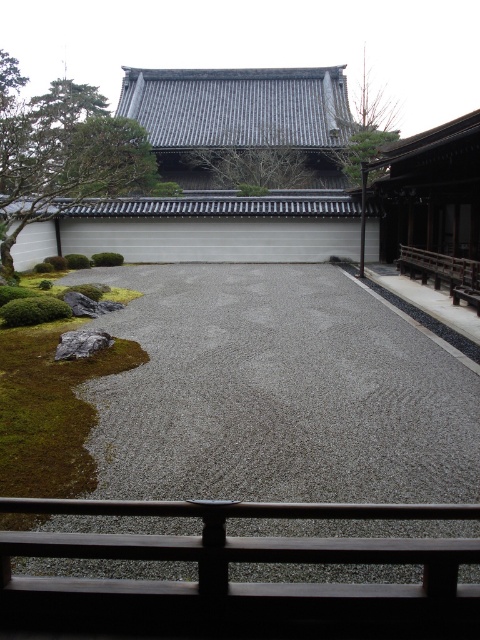
Is green leafy tree at upper center smaller than gray/smooth rock at lower left?

Incorrect, green leafy tree at upper center is not smaller in size than gray/smooth rock at lower left.

Does green leafy tree at upper center appear under gray/smooth rock at lower left?

Incorrect, green leafy tree at upper center is not positioned below gray/smooth rock at lower left.

This screenshot has height=640, width=480. Describe the element at coordinates (252, 166) in the screenshot. I see `green leafy tree at upper center` at that location.

Locate an element on the screen. green leafy tree at upper center is located at coordinates (252, 166).

Between gray gravel at center and green leafy tree at upper left, which one has less height?

gray gravel at center is shorter.

Does gray gravel at center have a larger size compared to green leafy tree at upper left?

Incorrect, gray gravel at center is not larger than green leafy tree at upper left.

Where is `gray gravel at center`? The image size is (480, 640). gray gravel at center is located at coordinates (278, 394).

Locate an element on the screen. This screenshot has height=640, width=480. gray gravel at center is located at coordinates (278, 394).

Does gray gravel at center have a lesser width compared to green leafy tree at upper center?

Yes, gray gravel at center is thinner than green leafy tree at upper center.

Can you confirm if gray gravel at center is positioned to the right of green leafy tree at upper center?

Yes, gray gravel at center is to the right of green leafy tree at upper center.

Who is more forward, (154, 330) or (285, 164)?

Point (154, 330) is in front.

Image resolution: width=480 pixels, height=640 pixels. I want to click on gray gravel at center, so click(278, 394).